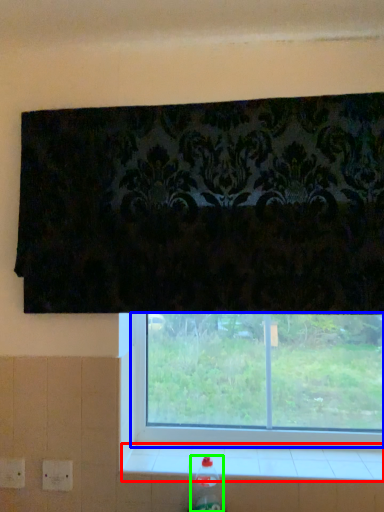
Question: Which is farther away from window sill (highlighted by a red box)? window (highlighted by a blue box) or bottle (highlighted by a green box)?

Choices:
 (A) window
 (B) bottle

Answer: (B)